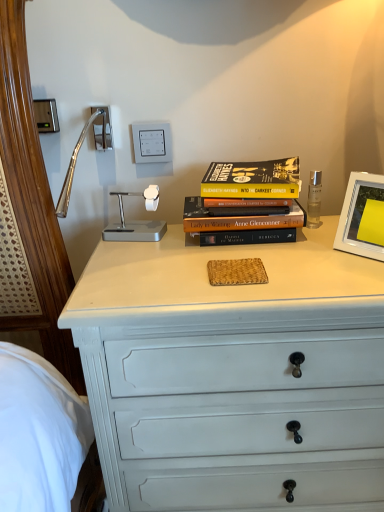
In order to face white plastic picture frame at upper right, should I rotate leftwards or rightwards?

A 25.303 degree turn to the right will do.

Where is `hardcover book at center`? hardcover book at center is located at coordinates (247, 203).

The height and width of the screenshot is (512, 384). What are the coordinates of `white plastic switch at upper center, which is the second electric outlet in left-to-right order` in the screenshot? It's located at (x=152, y=142).

From the picture: From the image's perspective, is hardcover book at center positioned above or below white plastic switch at upper center, which appears as the first electric outlet when viewed from the right?

From the image's perspective, hardcover book at center appears below white plastic switch at upper center, which appears as the first electric outlet when viewed from the right.

Could you tell me if hardcover book at center is turned towards white plastic switch at upper center, which appears as the first electric outlet when viewed from the right?

No, hardcover book at center is not aimed at white plastic switch at upper center, which appears as the first electric outlet when viewed from the right.

From a real-world perspective, which is physically below, hardcover book at center or white plastic switch at upper center, which appears as the first electric outlet when viewed from the right?

hardcover book at center, from a real-world perspective.

In the scene shown: Could you tell me if white painted wood chest of drawers at center is facing white plastic picture frame at upper right?

No, white painted wood chest of drawers at center is not facing towards white plastic picture frame at upper right.

Can you confirm if white painted wood chest of drawers at center is taller than white plastic picture frame at upper right?

Yes.

Which of these two, white painted wood chest of drawers at center or white plastic picture frame at upper right, is smaller?

With smaller size is white plastic picture frame at upper right.

Is white plastic switch at upper center, which appears as the first electric outlet when viewed from the right, positioned behind white painted wood chest of drawers at center?

That is True.

From the image's perspective, does white plastic switch at upper center, which appears as the first electric outlet when viewed from the right, appear higher than white painted wood chest of drawers at center?

Yes.

Is the surface of white plastic switch at upper center, which is the second electric outlet in left-to-right order, in direct contact with white painted wood chest of drawers at center?

No, white plastic switch at upper center, which is the second electric outlet in left-to-right order, is not making contact with white painted wood chest of drawers at center.

Can you confirm if white plastic switch at upper center, which is the second electric outlet in left-to-right order, is positioned to the right of white painted wood chest of drawers at center?

No, white plastic switch at upper center, which is the second electric outlet in left-to-right order, is not to the right of white painted wood chest of drawers at center.

Considering the positions of point (107, 119) and point (271, 176), is point (107, 119) closer or farther from the camera than point (271, 176)?

Clearly, point (107, 119) is more distant from the camera than point (271, 176).

Based on the photo, is satin nickel outlet at upper left, the second electric outlet viewed from the right, looking in the opposite direction of hardcover book at center?

No, satin nickel outlet at upper left, the second electric outlet viewed from the right,'s orientation is not away from hardcover book at center.

Can you confirm if satin nickel outlet at upper left, the second electric outlet viewed from the right, is shorter than hardcover book at center?

Yes, satin nickel outlet at upper left, the second electric outlet viewed from the right, is shorter than hardcover book at center.

You are a GUI agent. You are given a task and a screenshot of the screen. Output one action in this format:
    pyautogui.click(x=<x>, y=<y>)
    Task: Click on the 2nd electric outlet to the left when counting from the hardcover book at center
    The image size is (384, 512).
    Given the screenshot: What is the action you would take?
    pyautogui.click(x=102, y=128)

Can you confirm if hardcover book at center is positioned to the left of white painted wood chest of drawers at center?

Yes, hardcover book at center is to the left of white painted wood chest of drawers at center.

From the image's perspective, is hardcover book at center below white painted wood chest of drawers at center?

Actually, hardcover book at center appears above white painted wood chest of drawers at center in the image.

Considering the sizes of objects hardcover book at center and white painted wood chest of drawers at center in the image provided, who is wider, hardcover book at center or white painted wood chest of drawers at center?

With larger width is white painted wood chest of drawers at center.

Is hardcover book at center far from white painted wood chest of drawers at center?

No, hardcover book at center is not far from white painted wood chest of drawers at center.

Which object is thinner, white plastic switch at upper center, which is the second electric outlet in left-to-right order, or hardcover book at center?

white plastic switch at upper center, which is the second electric outlet in left-to-right order, is thinner.

Between white plastic switch at upper center, which is the second electric outlet in left-to-right order, and hardcover book at center, which one has larger size?

hardcover book at center is bigger.

In the scene shown: From the image's perspective, relative to hardcover book at center, is white plastic switch at upper center, which is the second electric outlet in left-to-right order, above or below?

From the image's perspective, white plastic switch at upper center, which is the second electric outlet in left-to-right order, appears above hardcover book at center.

Is white painted wood chest of drawers at center positioned far away from hardcover book at center?

white painted wood chest of drawers at center is near hardcover book at center, not far away.

Is white painted wood chest of drawers at center positioned with its back to hardcover book at center?

No, white painted wood chest of drawers at center is not facing away from hardcover book at center.

Is white painted wood chest of drawers at center closer to camera compared to hardcover book at center?

That is True.

How different are the orientations of white painted wood chest of drawers at center and hardcover book at center in degrees?

There is a 0.694-degree angle between the facing directions of white painted wood chest of drawers at center and hardcover book at center.

I want to click on book below the white plastic switch at upper center, which is the second electric outlet in left-to-right order (from the image's perspective), so click(x=247, y=203).

Where is `picture frame on the right side of white painted wood chest of drawers at center`? The width and height of the screenshot is (384, 512). picture frame on the right side of white painted wood chest of drawers at center is located at coordinates (362, 217).

Based on their spatial positions, is white plastic picture frame at upper right or hardcover book at center closer to satin nickel outlet at upper left, positioned as the 1th electric outlet in left-to-right order?

hardcover book at center is closer to satin nickel outlet at upper left, positioned as the 1th electric outlet in left-to-right order.

Which object lies further to the anchor point white plastic switch at upper center, which is the second electric outlet in left-to-right order, satin nickel outlet at upper left, positioned as the 1th electric outlet in left-to-right order, or hardcover book at center?

Among the two, hardcover book at center is located further to white plastic switch at upper center, which is the second electric outlet in left-to-right order.

Which object lies further to the anchor point satin nickel outlet at upper left, positioned as the 1th electric outlet in left-to-right order, hardcover book at center or white plastic picture frame at upper right?

white plastic picture frame at upper right is further to satin nickel outlet at upper left, positioned as the 1th electric outlet in left-to-right order.

From the image, which object appears to be farther from white plastic picture frame at upper right, white painted wood chest of drawers at center or satin nickel outlet at upper left, the second electric outlet viewed from the right?

The object further to white plastic picture frame at upper right is satin nickel outlet at upper left, the second electric outlet viewed from the right.

Estimate the real-world distances between objects in this image. Which object is closer to white plastic switch at upper center, which is the second electric outlet in left-to-right order, white painted wood chest of drawers at center or satin nickel outlet at upper left, the second electric outlet viewed from the right?

satin nickel outlet at upper left, the second electric outlet viewed from the right, is positioned closer to the anchor white plastic switch at upper center, which is the second electric outlet in left-to-right order.

When comparing their distances from white painted wood chest of drawers at center, does satin nickel outlet at upper left, positioned as the 1th electric outlet in left-to-right order, or white plastic switch at upper center, which appears as the first electric outlet when viewed from the right, seem closer?

white plastic switch at upper center, which appears as the first electric outlet when viewed from the right, is positioned closer to the anchor white painted wood chest of drawers at center.

Based on their spatial positions, is white painted wood chest of drawers at center or hardcover book at center closer to white plastic switch at upper center, which is the second electric outlet in left-to-right order?

hardcover book at center is closer to white plastic switch at upper center, which is the second electric outlet in left-to-right order.

Considering their positions, is satin nickel outlet at upper left, the second electric outlet viewed from the right, positioned further to white plastic switch at upper center, which appears as the first electric outlet when viewed from the right, than white painted wood chest of drawers at center?

Among the two, white painted wood chest of drawers at center is located further to white plastic switch at upper center, which appears as the first electric outlet when viewed from the right.

I want to click on electric outlet that lies between satin nickel outlet at upper left, the second electric outlet viewed from the right, and white painted wood chest of drawers at center from top to bottom, so click(152, 142).

Find the location of a particular element. This screenshot has height=512, width=384. book between satin nickel outlet at upper left, the second electric outlet viewed from the right, and white painted wood chest of drawers at center in the up-down direction is located at coordinates (247, 203).

At what (x,y) coordinates should I click in order to perform the action: click on electric outlet between satin nickel outlet at upper left, positioned as the 1th electric outlet in left-to-right order, and hardcover book at center, in the horizontal direction. Please return your answer as a coordinate pair (x, y). Looking at the image, I should click on (152, 142).

The height and width of the screenshot is (512, 384). What are the coordinates of `book located between white plastic switch at upper center, which is the second electric outlet in left-to-right order, and white plastic picture frame at upper right in the left-right direction` in the screenshot? It's located at (247, 203).